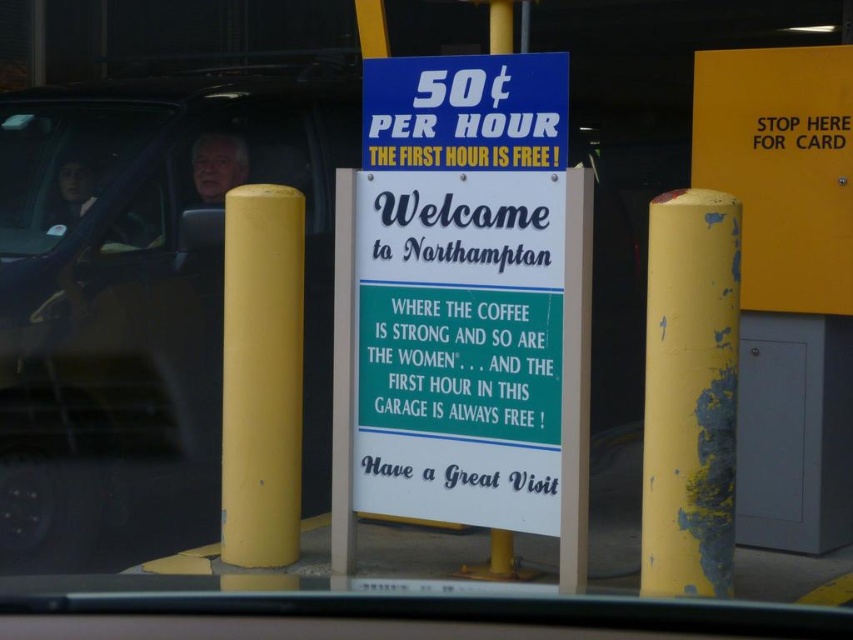
Question: Is matte black suv at left to the left of matte black car window at left from the viewer's perspective?

Choices:
 (A) yes
 (B) no

Answer: (B)

Question: In this image, where is peeling paint yellow post at right located relative to yellow matte pole at left?

Choices:
 (A) below
 (B) above

Answer: (A)

Question: Which point is closer to the camera taking this photo?

Choices:
 (A) (277, 493)
 (B) (711, 93)

Answer: (A)

Question: Which of the following is the closest to the observer?

Choices:
 (A) yellow matte pole at left
 (B) matte black suv at left
 (C) matte black car window at left

Answer: (A)

Question: Among these points, which one is nearest to the camera?

Choices:
 (A) (21, 204)
 (B) (732, 451)

Answer: (B)

Question: Does yellow matte sign at right have a larger size compared to yellow matte pole at left?

Choices:
 (A) no
 (B) yes

Answer: (B)